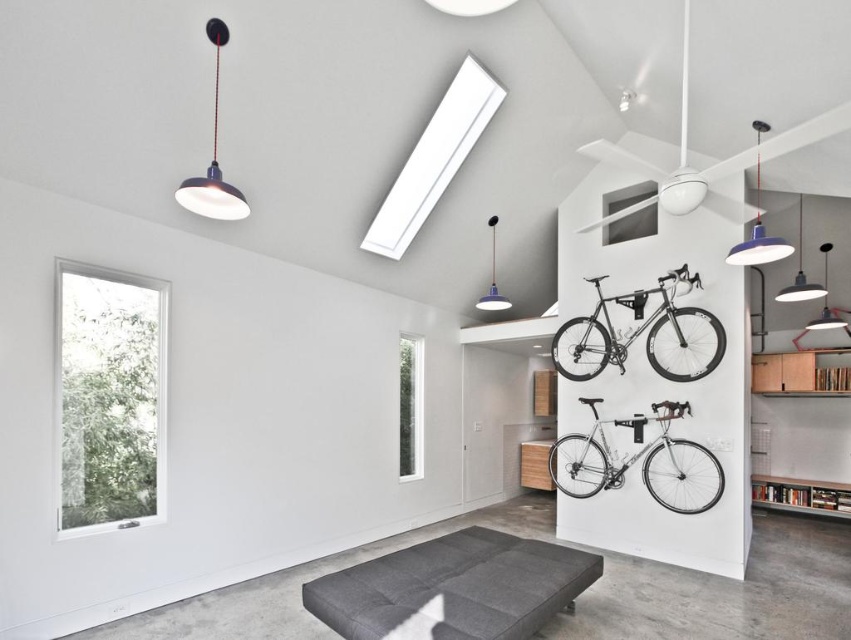
Question: Which point is closer to the camera?

Choices:
 (A) (675, 404)
 (B) (487, 637)

Answer: (B)

Question: Observing the image, what is the correct spatial positioning of silver metallic bicycle at upper right in reference to silver metallic bicycle at lower right?

Choices:
 (A) left
 (B) right

Answer: (B)

Question: From the image, what is the correct spatial relationship of dark gray fabric bench at lower center in relation to silver metallic bicycle at lower right?

Choices:
 (A) above
 (B) below

Answer: (B)

Question: Which point appears closest to the camera in this image?

Choices:
 (A) (655, 442)
 (B) (392, 554)
 (C) (665, 276)

Answer: (B)

Question: Which of the following is the farthest from the observer?

Choices:
 (A) silver metallic bicycle at lower right
 (B) silver metallic bicycle at upper right

Answer: (B)

Question: Is dark gray fabric bench at lower center smaller than silver metallic bicycle at lower right?

Choices:
 (A) yes
 (B) no

Answer: (A)